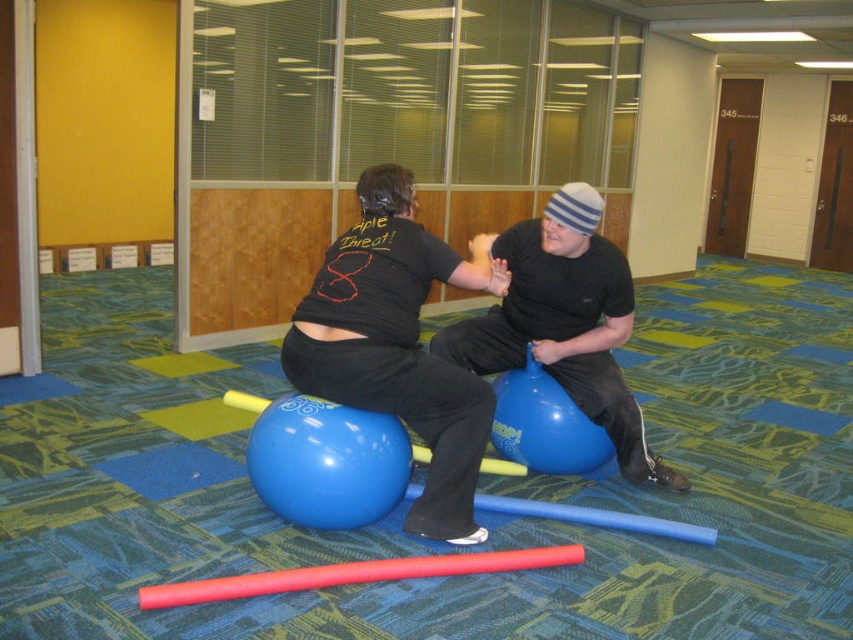
In the scene shown: Which of these two, shiny blue exercise ball at center or blue rubber ball at center, stands shorter?

blue rubber ball at center

Which is in front, point (447, 264) or point (576, 358)?

Positioned in front is point (447, 264).

The width and height of the screenshot is (853, 640). I want to click on shiny blue exercise ball at center, so click(x=398, y=344).